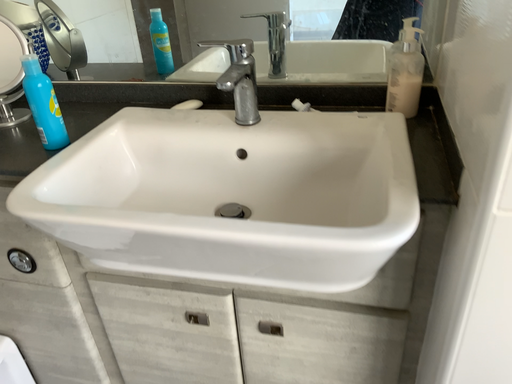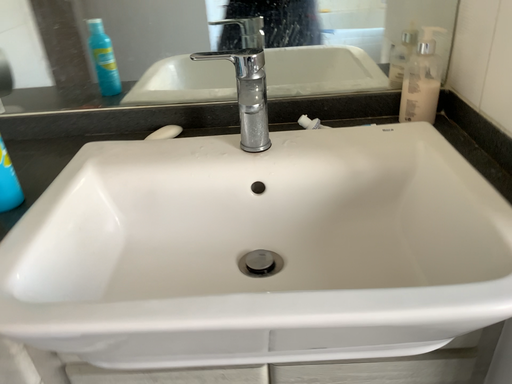
Question: How did the camera likely rotate when shooting the video?

Choices:
 (A) rotated left
 (B) rotated right

Answer: (B)